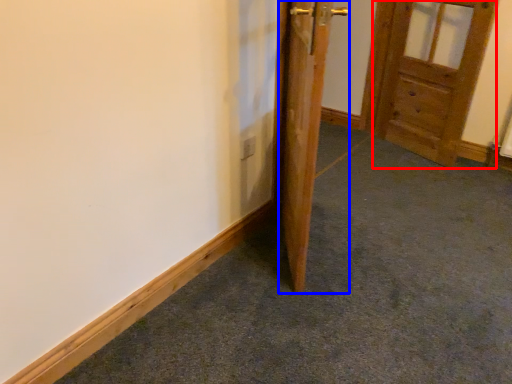
Question: Which object appears farthest to the camera in this image, door (highlighted by a red box) or door (highlighted by a blue box)?

Choices:
 (A) door
 (B) door

Answer: (A)